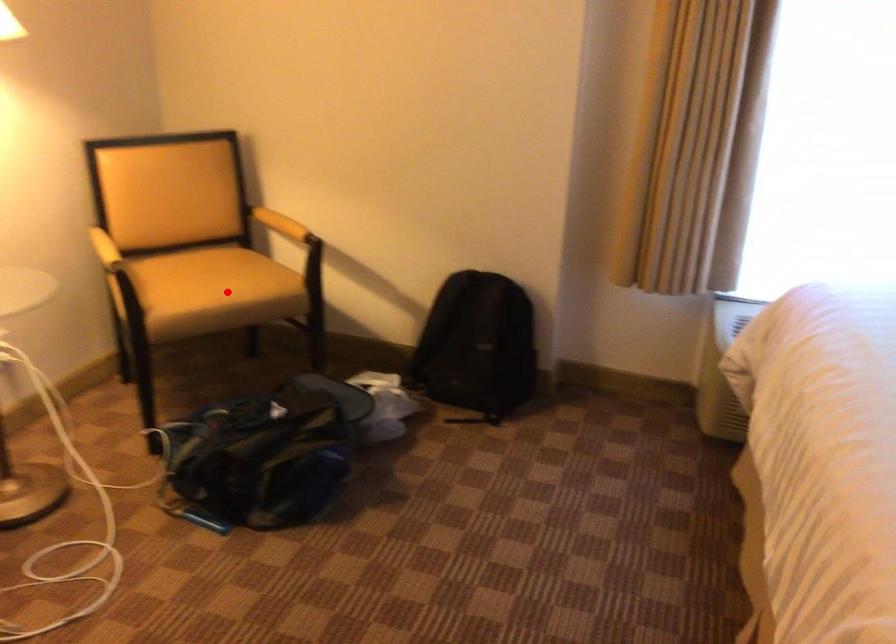
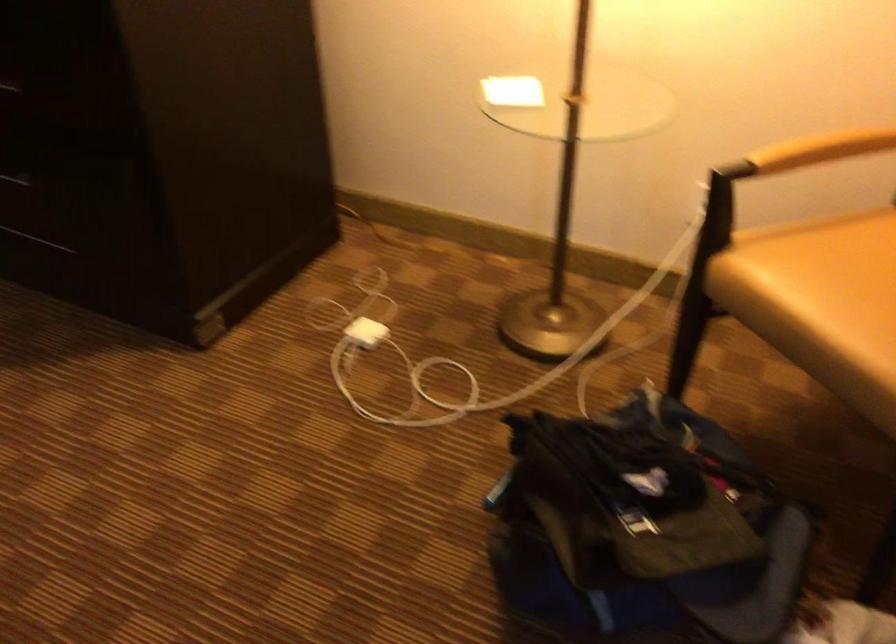
The point at the highlighted location is marked in the first image. Where is the corresponding point in the second image?

(821, 303)